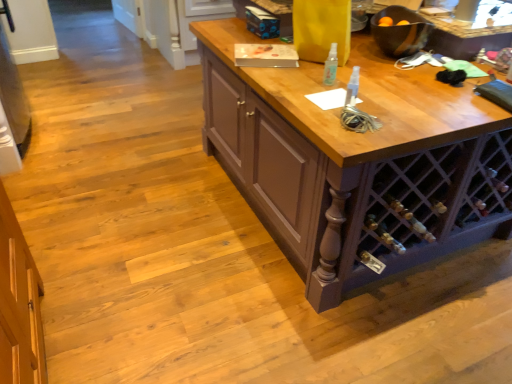
Question: Can you see metallic silver wine bottle at lower right touching clear plastic spray bottle at center?

Choices:
 (A) no
 (B) yes

Answer: (A)

Question: Does metallic silver wine bottle at lower right come in front of clear plastic spray bottle at center?

Choices:
 (A) yes
 (B) no

Answer: (B)

Question: Can you confirm if metallic silver wine bottle at lower right is smaller than clear plastic spray bottle at center?

Choices:
 (A) no
 (B) yes

Answer: (A)

Question: Can you confirm if metallic silver wine bottle at lower right is wider than clear plastic spray bottle at center?

Choices:
 (A) yes
 (B) no

Answer: (A)

Question: Is metallic silver wine bottle at lower right bigger than clear plastic spray bottle at center?

Choices:
 (A) yes
 (B) no

Answer: (A)

Question: Does metallic silver wine bottle at lower right contain clear plastic spray bottle at center?

Choices:
 (A) no
 (B) yes

Answer: (A)

Question: Is clear plastic spray bottle at center placed right next to metallic silver wine bottle at lower right?

Choices:
 (A) yes
 (B) no

Answer: (B)

Question: Considering the relative sizes of clear plastic spray bottle at center and metallic silver wine bottle at lower right in the image provided, is clear plastic spray bottle at center shorter than metallic silver wine bottle at lower right?

Choices:
 (A) no
 (B) yes

Answer: (A)

Question: Is clear plastic spray bottle at center in front of metallic silver wine bottle at lower right?

Choices:
 (A) no
 (B) yes

Answer: (B)

Question: Is clear plastic spray bottle at center to the right of metallic silver wine bottle at lower right from the viewer's perspective?

Choices:
 (A) yes
 (B) no

Answer: (B)

Question: From the image's perspective, would you say clear plastic spray bottle at center is shown under metallic silver wine bottle at lower right?

Choices:
 (A) yes
 (B) no

Answer: (B)

Question: Is metallic silver wine bottle at lower right at the back of clear plastic spray bottle at center?

Choices:
 (A) no
 (B) yes

Answer: (A)

Question: Is clear plastic spray bottle at center in front of or behind metallic silver wine bottle at lower right in the image?

Choices:
 (A) behind
 (B) front

Answer: (B)